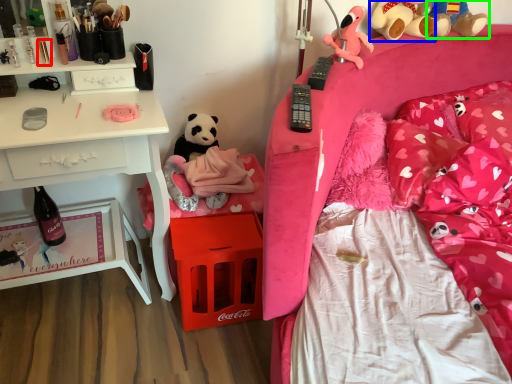
Question: Estimate the real-world distances between objects in this image. Which object is farther from toiletry (highlighted by a red box), teddy bear (highlighted by a blue box) or toy (highlighted by a green box)?

Choices:
 (A) teddy bear
 (B) toy

Answer: (B)